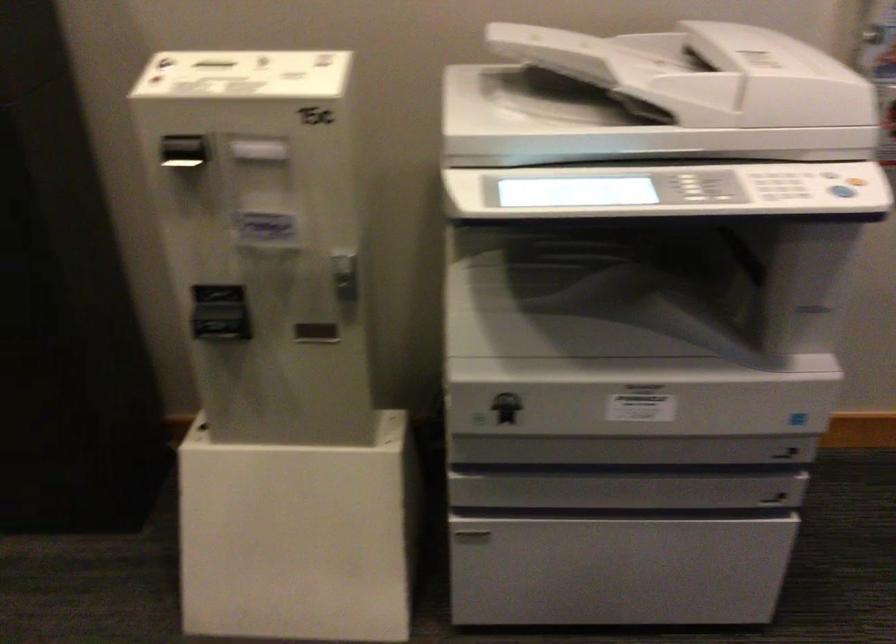
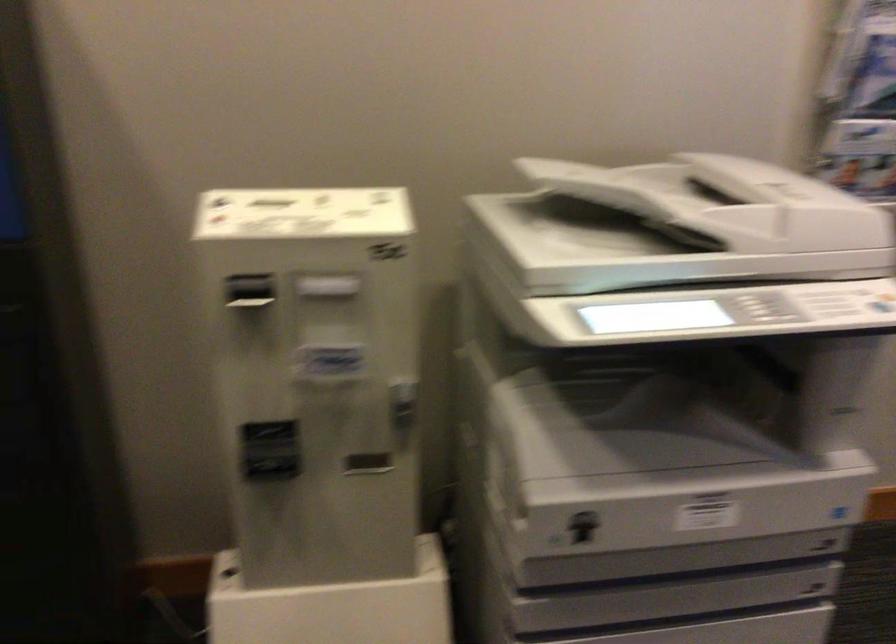
Question: Based on the continuous images, in which direction is the camera rotating? Reply with the corresponding letter.

Choices:
 (A) Left
 (B) Right
 (C) Up
 (D) Down

Answer: (B)